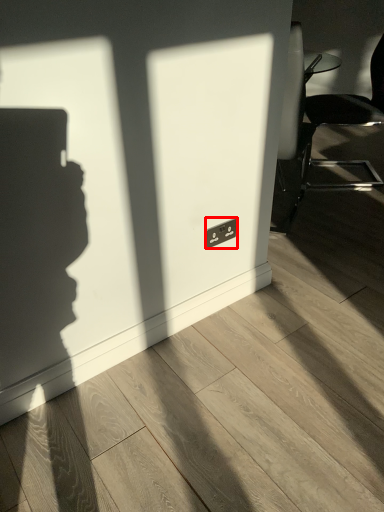
Question: Considering the relative positions of electric outlet (annotated by the red box) and chair in the image provided, where is electric outlet (annotated by the red box) located with respect to the staircase?

Choices:
 (A) right
 (B) left

Answer: (B)